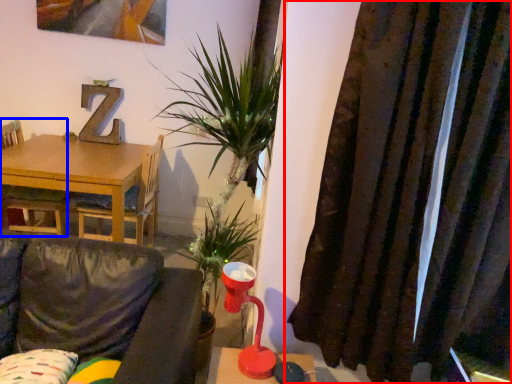
Question: Among these objects, which one is farthest to the camera, curtain (highlighted by a red box) or chair (highlighted by a blue box)?

Choices:
 (A) curtain
 (B) chair

Answer: (B)